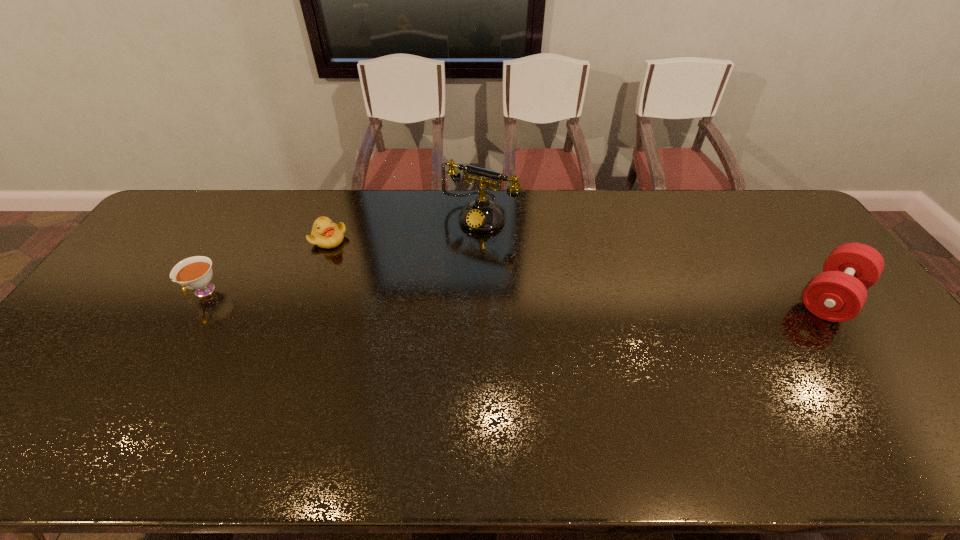
You are a GUI agent. You are given a task and a screenshot of the screen. Output one action in this format:
    pyautogui.click(x=<x>, y=<y>)
    Task: Click on the free space on the desktop that is between the leftmost object and the dumbbell and is positioned on the dial of the telephone
    The width and height of the screenshot is (960, 540).
    Given the screenshot: What is the action you would take?
    click(422, 294)

The image size is (960, 540). Identify the location of free space on the desktop that is between the leftmost object and the second tallest object and is positioned on the front-facing side of the duckling. (447, 294).